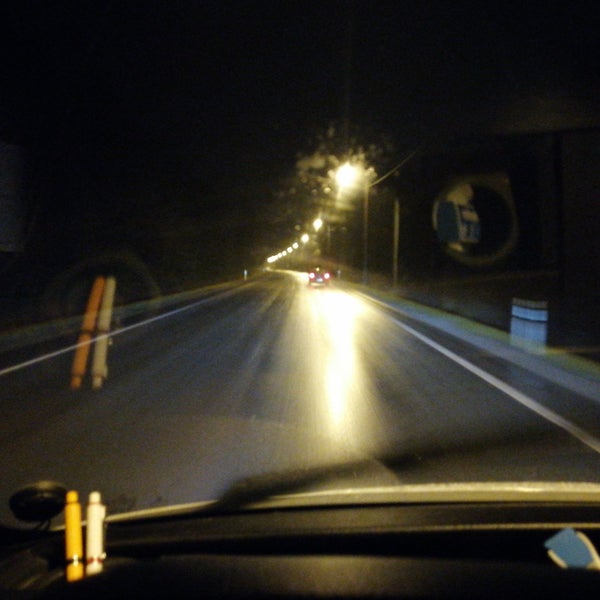
Where is `pen`? pen is located at coordinates (77, 533), (98, 530).